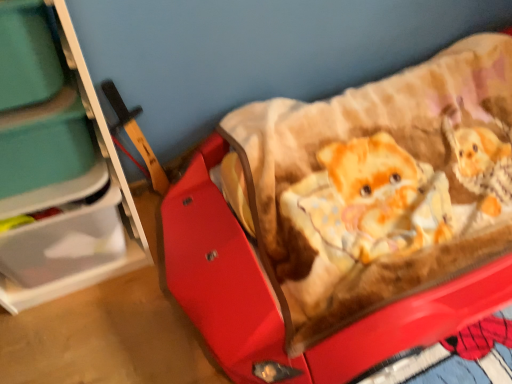
Image resolution: width=512 pixels, height=384 pixels. What do you see at coordinates (57, 168) in the screenshot?
I see `translucent plastic storage at left` at bounding box center [57, 168].

This screenshot has height=384, width=512. I want to click on translucent plastic storage at left, so click(57, 168).

Can you confirm if translucent plastic storage at left is shorter than teal plastic storage box at left?

Incorrect, the height of translucent plastic storage at left does not fall short of that of teal plastic storage box at left.

Identify the location of furniture below the teal plastic storage box at left (from the image's perspective). This screenshot has height=384, width=512. (57, 168).

Is translucent plastic storage at left closer to the viewer compared to teal plastic storage box at left?

Yes.

From a real-world perspective, is translucent plastic storage at left physically located above or below teal plastic storage box at left?

translucent plastic storage at left is situated lower than teal plastic storage box at left in the real world.

Is point (487, 254) positioned behind point (31, 80)?

Yes, point (487, 254) is behind point (31, 80).

The height and width of the screenshot is (384, 512). Identify the location of baby carriage above the translucent plastic storage at left (from the image's perspective). (350, 221).

Is red plastic baby carriage at center bigger than translucent plastic storage at left?

Indeed, red plastic baby carriage at center has a larger size compared to translucent plastic storage at left.

Is red plastic baby carriage at center positioned with its back to teal plastic storage box at left?

No, red plastic baby carriage at center is not facing the opposite direction of teal plastic storage box at left.

Is red plastic baby carriage at center bigger or smaller than teal plastic storage box at left?

In the image, red plastic baby carriage at center appears to be larger than teal plastic storage box at left.

Is red plastic baby carriage at center at the left side of teal plastic storage box at left?

In fact, red plastic baby carriage at center is to the right of teal plastic storage box at left.

Would you say red plastic baby carriage at center is part of translucent plastic storage at left's contents?

No, red plastic baby carriage at center is not a part of translucent plastic storage at left.

From the image's perspective, which is above, translucent plastic storage at left or red plastic baby carriage at center?

red plastic baby carriage at center is shown above in the image.

Does translucent plastic storage at left turn towards red plastic baby carriage at center?

No, translucent plastic storage at left is not facing towards red plastic baby carriage at center.

Does teal plastic storage box at left have a larger size compared to translucent plastic storage at left?

Actually, teal plastic storage box at left might be smaller than translucent plastic storage at left.

Which of these two, teal plastic storage box at left or translucent plastic storage at left, is wider?

Wider between the two is translucent plastic storage at left.

Would you say teal plastic storage box at left is inside or outside translucent plastic storage at left?

teal plastic storage box at left is spatially positioned inside translucent plastic storage at left.

From a real-world perspective, which object stands above the other?

From a 3D spatial view, teal plastic storage box at left is above.

Which object is positioned more to the right, teal plastic storage box at left or red plastic baby carriage at center?

red plastic baby carriage at center is more to the right.

Does teal plastic storage box at left have a smaller size compared to red plastic baby carriage at center?

Yes.

From the picture: Between teal plastic storage box at left and red plastic baby carriage at center, which one has smaller width?

With smaller width is teal plastic storage box at left.

You are a GUI agent. You are given a task and a screenshot of the screen. Output one action in this format:
    pyautogui.click(x=<x>, y=<y>)
    Task: Click on the furniture located below the teal plastic storage box at left (from the image's perspective)
    The height and width of the screenshot is (384, 512).
    Given the screenshot: What is the action you would take?
    pyautogui.click(x=57, y=168)

At what (x,y) coordinates should I click in order to perform the action: click on furniture on the left side of red plastic baby carriage at center. Please return your answer as a coordinate pair (x, y). Image resolution: width=512 pixels, height=384 pixels. Looking at the image, I should click on (57, 168).

Based on their spatial positions, is teal plastic storage box at left or red plastic baby carriage at center further from translucent plastic storage at left?

red plastic baby carriage at center.

Based on their spatial positions, is red plastic baby carriage at center or teal plastic storage box at left further from translucent plastic storage at left?

red plastic baby carriage at center is further to translucent plastic storage at left.

From the image, which object appears to be farther from red plastic baby carriage at center, teal plastic storage box at left or translucent plastic storage at left?

Based on the image, teal plastic storage box at left appears to be further to red plastic baby carriage at center.

Which object lies further to the anchor point red plastic baby carriage at center, translucent plastic storage at left or teal plastic storage box at left?

Based on the image, teal plastic storage box at left appears to be further to red plastic baby carriage at center.

Estimate the real-world distances between objects in this image. Which object is closer to teal plastic storage box at left, red plastic baby carriage at center or translucent plastic storage at left?

translucent plastic storage at left.

Looking at this image, from the image, which object appears to be nearer to teal plastic storage box at left, translucent plastic storage at left or red plastic baby carriage at center?

Based on the image, translucent plastic storage at left appears to be nearer to teal plastic storage box at left.

Locate an element on the screen. This screenshot has width=512, height=384. storage box situated between translucent plastic storage at left and red plastic baby carriage at center from left to right is located at coordinates (44, 145).